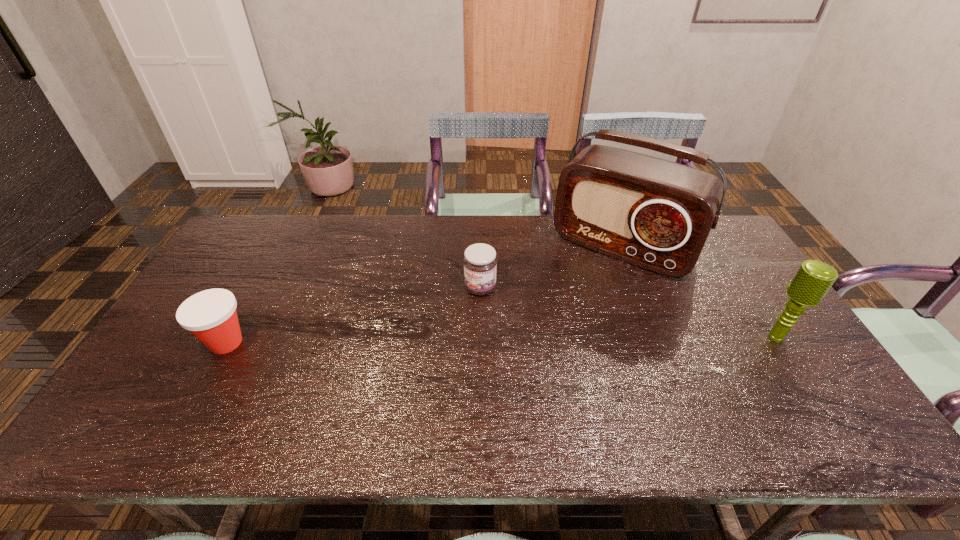
The image size is (960, 540). In order to click on vacant area at the near edge in this screenshot , I will do `click(427, 386)`.

Identify the location of free space at the left edge of the desktop. The image size is (960, 540). (243, 280).

The height and width of the screenshot is (540, 960). What are the coordinates of `vacant space at the right edge of the desktop` in the screenshot? It's located at (757, 319).

Where is `free space at the far left corner of the desktop`? This screenshot has height=540, width=960. free space at the far left corner of the desktop is located at coordinates click(x=265, y=222).

Where is `vacant space that is in between the tallest object and the rightmost object`? The image size is (960, 540). vacant space that is in between the tallest object and the rightmost object is located at coordinates (700, 292).

I want to click on free space between the Dixie cup and the radio receiver, so click(424, 295).

Image resolution: width=960 pixels, height=540 pixels. I want to click on free spot between the second object from left to right and the rightmost object, so click(x=628, y=312).

Locate an element on the screen. vacant point located between the third object from left to right and the jam is located at coordinates coord(552,267).

You are a GUI agent. You are given a task and a screenshot of the screen. Output one action in this format:
    pyautogui.click(x=<x>, y=<y>)
    Task: Click on the free spot between the leftmost object and the rightmost object
    The width and height of the screenshot is (960, 540).
    Given the screenshot: What is the action you would take?
    pyautogui.click(x=501, y=340)

The height and width of the screenshot is (540, 960). Find the location of `vacant area between the leftmost object and the rightmost object`. vacant area between the leftmost object and the rightmost object is located at coordinates (501, 340).